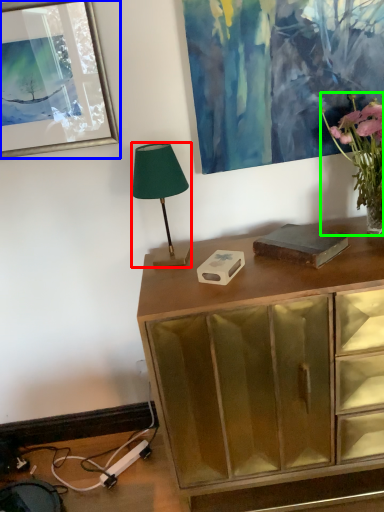
Question: Estimate the real-world distances between objects in this image. Which object is farther from lamp (highlighted by a red box), picture frame (highlighted by a blue box) or houseplant (highlighted by a green box)?

Choices:
 (A) picture frame
 (B) houseplant

Answer: (B)